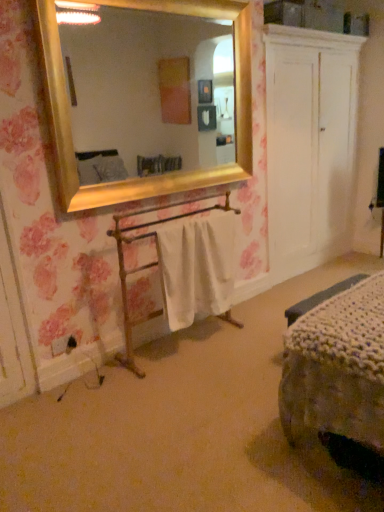
Measure the distance between point (220,273) and camera.

8.92 feet.

Describe the element at coordinates (197, 268) in the screenshot. The width and height of the screenshot is (384, 512). I see `white cotton towel at center` at that location.

Identify the location of white cotton towel at center. Image resolution: width=384 pixels, height=512 pixels. (197, 268).

Locate an element on the screen. white cotton towel at center is located at coordinates (197, 268).